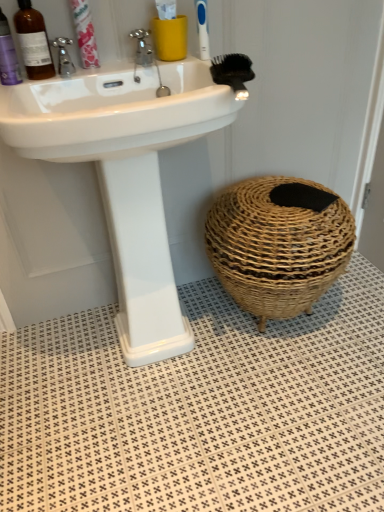
Image resolution: width=384 pixels, height=512 pixels. Describe the element at coordinates (8, 55) in the screenshot. I see `matte purple bottle at left, the second mouthwash when ordered from right to left` at that location.

Locate an element on the screen. The width and height of the screenshot is (384, 512). brushed metal faucet at upper left, acting as the first tap starting from the left is located at coordinates (63, 56).

Locate an element on the screen. This screenshot has width=384, height=512. black bristle brush at upper right is located at coordinates (233, 72).

Where is `blue plastic toothbrush at upper center`? blue plastic toothbrush at upper center is located at coordinates (202, 29).

How much distance is there between blue plastic toothbrush at upper center and matte yellow cup at upper center?

The distance of blue plastic toothbrush at upper center from matte yellow cup at upper center is 3.99 inches.

You are a GUI agent. You are given a task and a screenshot of the screen. Output one action in this format:
    pyautogui.click(x=<x>, y=<y>)
    Task: Click on the toothbrush in front of the matte yellow cup at upper center
    The image size is (384, 512).
    Given the screenshot: What is the action you would take?
    pyautogui.click(x=202, y=29)

Is matte yellow cup at upper center at the back of blue plastic toothbrush at upper center?

blue plastic toothbrush at upper center does not have its back to matte yellow cup at upper center.

Is blue plastic toothbrush at upper center next to matte yellow cup at upper center and touching it?

They are not placed beside each other.

From a real-world perspective, which object stands above the other?

matte yellow cup at upper center.

Which is behind, point (138, 42) or point (177, 21)?

The point (138, 42) is more distant.

Could you tell me if metallic chrome faucet at upper center, which ranks as the 1th tap in right-to-left order, is facing matte yellow cup at upper center?

No.

Is metallic chrome faucet at upper center, the 2th tap viewed from the left, at the right side of matte yellow cup at upper center?

No.

Is translucent amber bottle at upper left, the first mouthwash in the right-to-left sequence, with brushed metal faucet at upper left, marked as the 2th tap in a right-to-left arrangement?

Indeed, translucent amber bottle at upper left, the first mouthwash in the right-to-left sequence, and brushed metal faucet at upper left, marked as the 2th tap in a right-to-left arrangement, are beside each other and touching.

Which is less distant, [29,69] or [64,74]?

Point [29,69].

Could you measure the distance between translucent amber bottle at upper left, the first mouthwash in the right-to-left sequence, and brushed metal faucet at upper left, acting as the first tap starting from the left?

translucent amber bottle at upper left, the first mouthwash in the right-to-left sequence, is 2.35 inches from brushed metal faucet at upper left, acting as the first tap starting from the left.

From a real-world perspective, is translucent amber bottle at upper left, which is counted as the 2th mouthwash, starting from the left, positioned above or below brushed metal faucet at upper left, acting as the first tap starting from the left?

translucent amber bottle at upper left, which is counted as the 2th mouthwash, starting from the left, is above brushed metal faucet at upper left, acting as the first tap starting from the left.

Can you confirm if braided wicker basket at lower right is shorter than blue plastic toothbrush at upper center?

No.

Considering the points (302, 296) and (202, 35), which point is behind, point (302, 296) or point (202, 35)?

Positioned behind is point (302, 296).

From the image's perspective, would you say braided wicker basket at lower right is positioned over blue plastic toothbrush at upper center?

No, from the image's perspective, braided wicker basket at lower right is not above blue plastic toothbrush at upper center.

Is braided wicker basket at lower right with blue plastic toothbrush at upper center?

There is a gap between braided wicker basket at lower right and blue plastic toothbrush at upper center.

Is translucent amber bottle at upper left, the first mouthwash in the right-to-left sequence, far from white textured tile at lower center?

Indeed, translucent amber bottle at upper left, the first mouthwash in the right-to-left sequence, is not near white textured tile at lower center.

Considering the relative positions of translucent amber bottle at upper left, which is counted as the 2th mouthwash, starting from the left, and white textured tile at lower center in the image provided, is translucent amber bottle at upper left, which is counted as the 2th mouthwash, starting from the left, in front of white textured tile at lower center?

No, it is not.

In the image, there is a translucent amber bottle at upper left, the first mouthwash in the right-to-left sequence. Identify the location of tile below it (from the image's perspective). (201, 410).

Does translucent amber bottle at upper left, the first mouthwash in the right-to-left sequence, have a greater width compared to white textured tile at lower center?

In fact, translucent amber bottle at upper left, the first mouthwash in the right-to-left sequence, might be narrower than white textured tile at lower center.

Which object is closer to the camera, white glossy sink at upper center or blue plastic toothbrush at upper center?

white glossy sink at upper center is more forward.

From a real-world perspective, is white glossy sink at upper center located higher than blue plastic toothbrush at upper center?

No.

Is white glossy sink at upper center thinner than blue plastic toothbrush at upper center?

In fact, white glossy sink at upper center might be wider than blue plastic toothbrush at upper center.

Do you think matte purple bottle at left, the second mouthwash when ordered from right to left, is within braided wicker basket at lower right, or outside of it?

matte purple bottle at left, the second mouthwash when ordered from right to left, is not enclosed by braided wicker basket at lower right.

From the image's perspective, is matte purple bottle at left, the second mouthwash when ordered from right to left, positioned above or below braided wicker basket at lower right?

Based on their image positions, matte purple bottle at left, the second mouthwash when ordered from right to left, is located above braided wicker basket at lower right.

Which is more to the right, matte purple bottle at left, the second mouthwash when ordered from right to left, or braided wicker basket at lower right?

braided wicker basket at lower right.

Is matte purple bottle at left, the second mouthwash when ordered from right to left, oriented away from braided wicker basket at lower right?

matte purple bottle at left, the second mouthwash when ordered from right to left, is not turned away from braided wicker basket at lower right.

Find the location of a particular element. This screenshot has width=384, height=512. toiletry on the left of blue plastic toothbrush at upper center is located at coordinates (169, 32).

In order to click on toiletry on the right of metallic chrome faucet at upper center, which ranks as the 1th tap in right-to-left order in this screenshot , I will do `click(169, 32)`.

Looking at the image, which one is located further to brushed metal faucet at upper left, marked as the 2th tap in a right-to-left arrangement, matte yellow cup at upper center or black bristle brush at upper right?

The object further to brushed metal faucet at upper left, marked as the 2th tap in a right-to-left arrangement, is black bristle brush at upper right.

Based on their spatial positions, is metallic chrome faucet at upper center, the 2th tap viewed from the left, or blue plastic toothbrush at upper center closer to white glossy sink at upper center?

metallic chrome faucet at upper center, the 2th tap viewed from the left, lies closer to white glossy sink at upper center than the other object.

Looking at the image, which one is located further to black bristle brush at upper right, translucent amber bottle at upper left, which is counted as the 2th mouthwash, starting from the left, or white textured tile at lower center?

Based on the image, white textured tile at lower center appears to be further to black bristle brush at upper right.

Estimate the real-world distances between objects in this image. Which object is closer to braided wicker basket at lower right, blue plastic toothbrush at upper center or matte purple bottle at left, the second mouthwash when ordered from right to left?

blue plastic toothbrush at upper center lies closer to braided wicker basket at lower right than the other object.

Based on their spatial positions, is brushed metal faucet at upper left, acting as the first tap starting from the left, or translucent amber bottle at upper left, which is counted as the 2th mouthwash, starting from the left, further from metallic chrome faucet at upper center, which ranks as the 1th tap in right-to-left order?

Among the two, translucent amber bottle at upper left, which is counted as the 2th mouthwash, starting from the left, is located further to metallic chrome faucet at upper center, which ranks as the 1th tap in right-to-left order.

Based on their spatial positions, is metallic chrome faucet at upper center, which ranks as the 1th tap in right-to-left order, or black bristle brush at upper right closer to white textured tile at lower center?

Among the two, black bristle brush at upper right is located nearer to white textured tile at lower center.

Looking at the image, which one is located closer to blue plastic toothbrush at upper center, white textured tile at lower center or matte yellow cup at upper center?

matte yellow cup at upper center lies closer to blue plastic toothbrush at upper center than the other object.

Estimate the real-world distances between objects in this image. Which object is closer to translucent amber bottle at upper left, which is counted as the 2th mouthwash, starting from the left, black bristle brush at upper right or pink paper toothpaste at upper left?

The object closer to translucent amber bottle at upper left, which is counted as the 2th mouthwash, starting from the left, is pink paper toothpaste at upper left.

Locate an element on the screen. This screenshot has height=512, width=384. sink between blue plastic toothbrush at upper center and white textured tile at lower center vertically is located at coordinates [126, 173].

Locate an element on the screen. The width and height of the screenshot is (384, 512). toothbrush situated between matte purple bottle at left, which appears as the first mouthwash when viewed from the left, and braided wicker basket at lower right from left to right is located at coordinates (202, 29).

At what (x,y) coordinates should I click in order to perform the action: click on sink between translucent amber bottle at upper left, which is counted as the 2th mouthwash, starting from the left, and braided wicker basket at lower right. Please return your answer as a coordinate pair (x, y). Looking at the image, I should click on (126, 173).

This screenshot has height=512, width=384. Find the location of `sink between matte purple bottle at left, which appears as the first mouthwash when viewed from the left, and black bristle brush at upper right from left to right`. sink between matte purple bottle at left, which appears as the first mouthwash when viewed from the left, and black bristle brush at upper right from left to right is located at coordinates (126, 173).